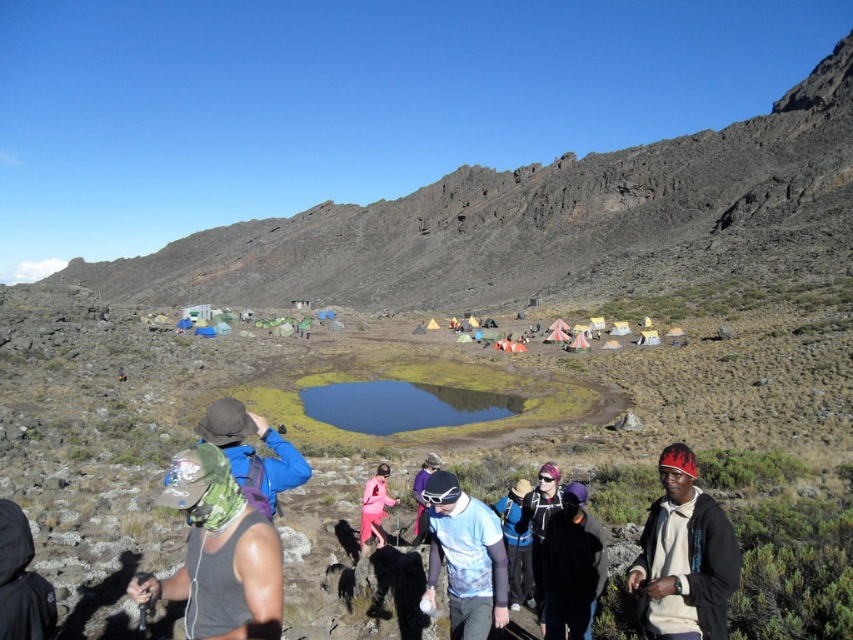
Question: Which of the following is the farthest from the observer?

Choices:
 (A) (451, 497)
 (B) (662, 461)
 (C) (231, 403)

Answer: (C)

Question: Which point is closer to the camera taking this photo?

Choices:
 (A) (0, 529)
 (B) (387, 506)
 (C) (422, 460)

Answer: (A)

Question: Does blue fabric jacket at center have a larger size compared to pink fabric pants at center?

Choices:
 (A) yes
 (B) no

Answer: (A)

Question: Which object is the closest to the black fleece jacket at center?

Choices:
 (A) clear glass lake at center
 (B) pink fabric pants at center
 (C) blue fabric jacket at center

Answer: (C)

Question: Does black knit cap at center have a greater width compared to pink fabric pants at center?

Choices:
 (A) yes
 (B) no

Answer: (A)

Question: Is black knit cap at center bigger than blue printed shirt at center?

Choices:
 (A) no
 (B) yes

Answer: (B)